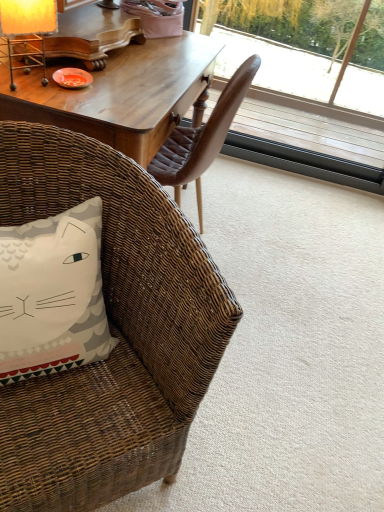
Question: Can you confirm if transparent glass window at upper right is wider than matte yellow lampshade at upper left?

Choices:
 (A) no
 (B) yes

Answer: (A)

Question: Could you tell me if transparent glass window at upper right is turned towards matte yellow lampshade at upper left?

Choices:
 (A) no
 (B) yes

Answer: (B)

Question: Can you confirm if transparent glass window at upper right is shorter than matte yellow lampshade at upper left?

Choices:
 (A) no
 (B) yes

Answer: (A)

Question: From a real-world perspective, does transparent glass window at upper right stand above matte yellow lampshade at upper left?

Choices:
 (A) no
 (B) yes

Answer: (A)

Question: Does transparent glass window at upper right have a smaller size compared to matte yellow lampshade at upper left?

Choices:
 (A) no
 (B) yes

Answer: (A)

Question: From the image's perspective, would you say transparent glass window at upper right is shown under matte yellow lampshade at upper left?

Choices:
 (A) yes
 (B) no

Answer: (B)

Question: Is matte yellow lampshade at upper left aimed at transparent glass window at upper right?

Choices:
 (A) yes
 (B) no

Answer: (A)

Question: Considering the relative positions of matte yellow lampshade at upper left and transparent glass window at upper right in the image provided, is matte yellow lampshade at upper left behind transparent glass window at upper right?

Choices:
 (A) yes
 (B) no

Answer: (B)

Question: From a real-world perspective, is matte yellow lampshade at upper left located higher than transparent glass window at upper right?

Choices:
 (A) no
 (B) yes

Answer: (B)

Question: Are matte yellow lampshade at upper left and transparent glass window at upper right located far from each other?

Choices:
 (A) no
 (B) yes

Answer: (B)

Question: Considering the relative sizes of matte yellow lampshade at upper left and transparent glass window at upper right in the image provided, is matte yellow lampshade at upper left taller than transparent glass window at upper right?

Choices:
 (A) yes
 (B) no

Answer: (B)

Question: From the image's perspective, is matte yellow lampshade at upper left located beneath transparent glass window at upper right?

Choices:
 (A) no
 (B) yes

Answer: (B)

Question: From a real-world perspective, is white fabric pillow with cat design at lower left over matte yellow lampshade at upper left?

Choices:
 (A) no
 (B) yes

Answer: (A)